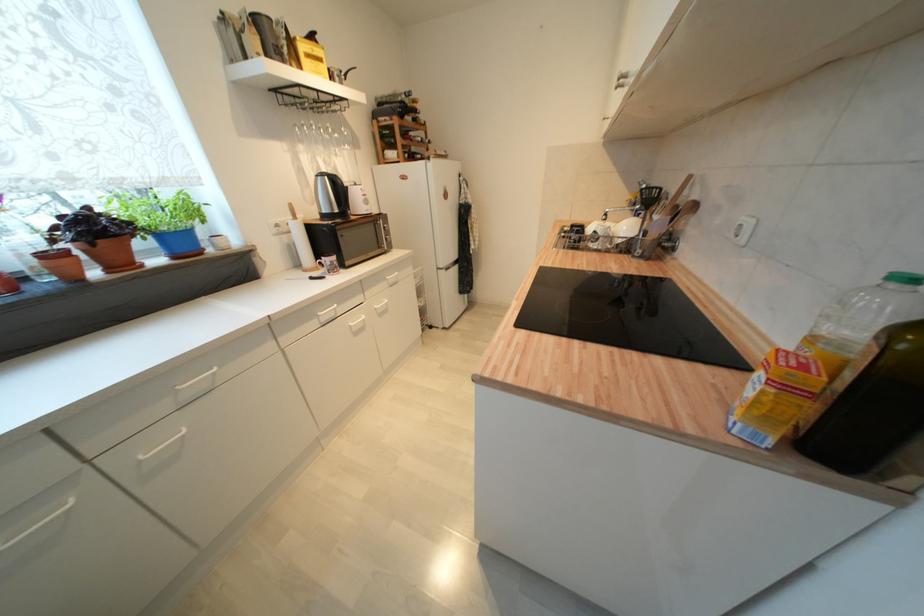
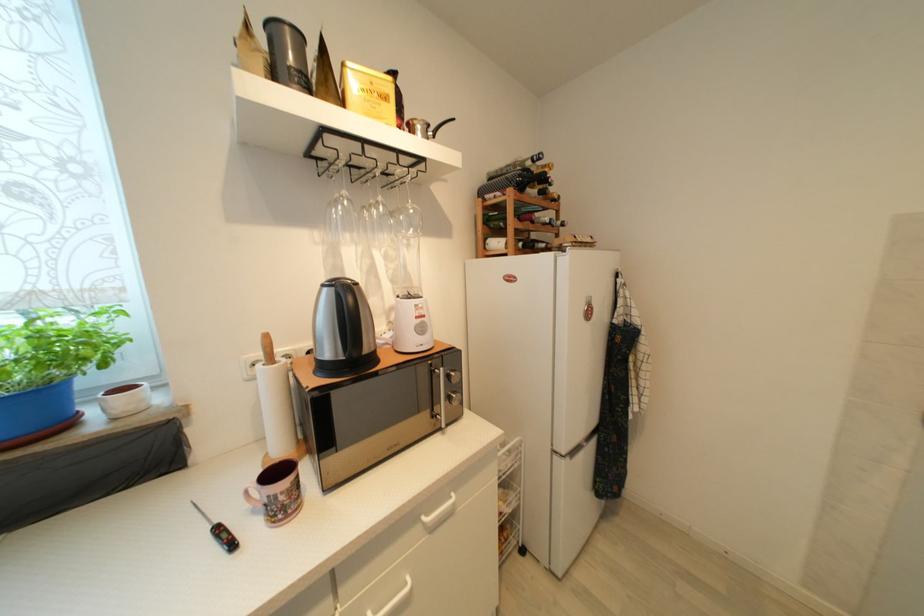
The point at (427,161) is marked in the first image. Where is the corresponding point in the second image?

(553, 251)